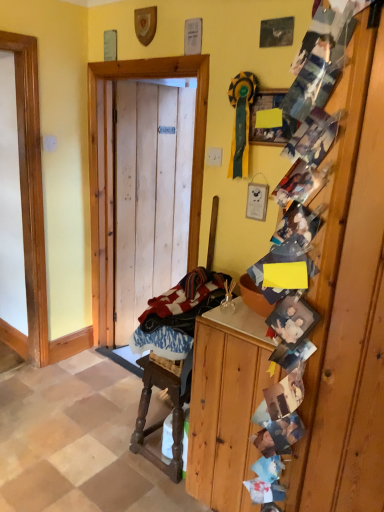
Where is `vacant area on top of wooden door at center (from a real-world perspective)`? The width and height of the screenshot is (384, 512). vacant area on top of wooden door at center (from a real-world perspective) is located at coordinates (156, 84).